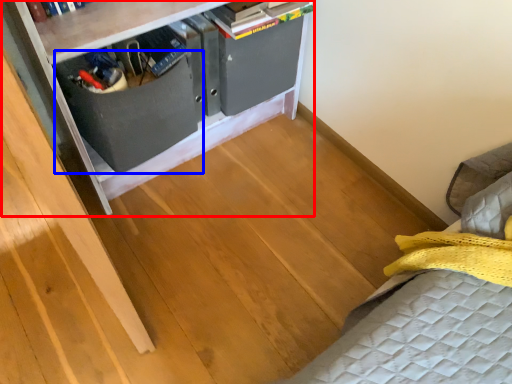
Question: Which object is further to the camera taking this photo, furniture (highlighted by a red box) or drawer (highlighted by a blue box)?

Choices:
 (A) furniture
 (B) drawer

Answer: (B)